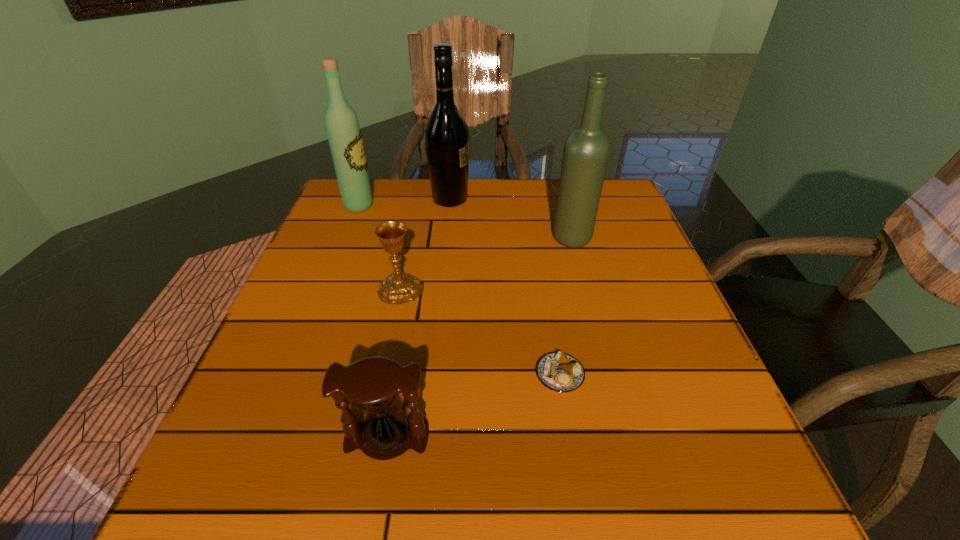
The image size is (960, 540). In order to click on vacant position at the right edge of the desktop in this screenshot , I will do `click(643, 306)`.

In the image, there is a desktop. Where is `vacant space at the far left corner`? vacant space at the far left corner is located at coordinates 335,195.

Identify the location of free spot at the near right corner of the desktop. This screenshot has width=960, height=540. (751, 483).

The width and height of the screenshot is (960, 540). I want to click on vacant region between the second nearest object and the chalice, so click(480, 332).

Where is `vacant area that lies between the second wine bottle from left to right and the leftmost object`? The width and height of the screenshot is (960, 540). vacant area that lies between the second wine bottle from left to right and the leftmost object is located at coordinates (404, 202).

I want to click on empty space that is in between the shortest object and the nearest object, so tap(473, 407).

Locate an element on the screen. The width and height of the screenshot is (960, 540). free area in between the leftmost wine bottle and the rightmost wine bottle is located at coordinates (466, 222).

At what (x,y) coordinates should I click in order to perform the action: click on vacant area that lies between the third farthest object and the pastry. Please return your answer as a coordinate pair (x, y). The image size is (960, 540). Looking at the image, I should click on (566, 307).

Identify the location of empty space that is in between the second wine bottle from left to right and the chalice. The width and height of the screenshot is (960, 540). (425, 244).

The width and height of the screenshot is (960, 540). I want to click on free space that is in between the rightmost wine bottle and the third nearest object, so click(x=487, y=264).